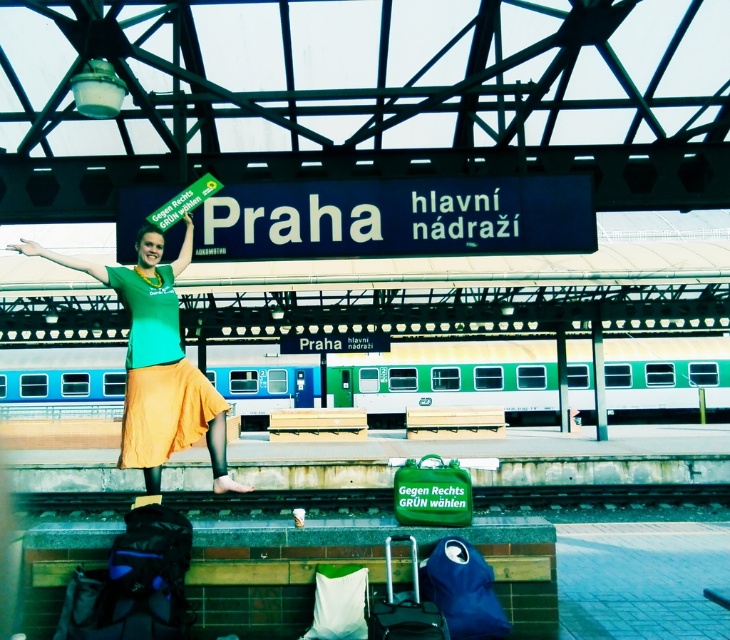
Is green metal train track at lower center wider than matte black suitcase at lower center?

Correct, the width of green metal train track at lower center exceeds that of matte black suitcase at lower center.

Between green metal train track at lower center and matte black suitcase at lower center, which one has less height?

matte black suitcase at lower center

Image resolution: width=730 pixels, height=640 pixels. What do you see at coordinates (607, 500) in the screenshot?
I see `green metal train track at lower center` at bounding box center [607, 500].

Where is `green metal train track at lower center`? green metal train track at lower center is located at coordinates (607, 500).

Which is below, green matte train at center or matte orange skirt at center?

green matte train at center is below.

Can you confirm if green matte train at center is positioned to the left of matte orange skirt at center?

Incorrect, green matte train at center is not on the left side of matte orange skirt at center.

Find the location of a particular element. green matte train at center is located at coordinates (445, 385).

Who is shorter, matte orange skirt at center or matte black suitcase at lower center?

With less height is matte black suitcase at lower center.

Who is positioned more to the left, matte orange skirt at center or matte black suitcase at lower center?

matte orange skirt at center

Locate an element on the screen. The image size is (730, 640). matte orange skirt at center is located at coordinates (158, 374).